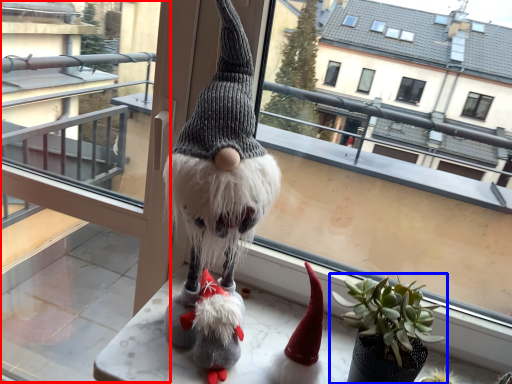
Question: Which point is closer to the camera, glass door (highlighted by a red box) or houseplant (highlighted by a blue box)?

Choices:
 (A) glass door
 (B) houseplant

Answer: (B)